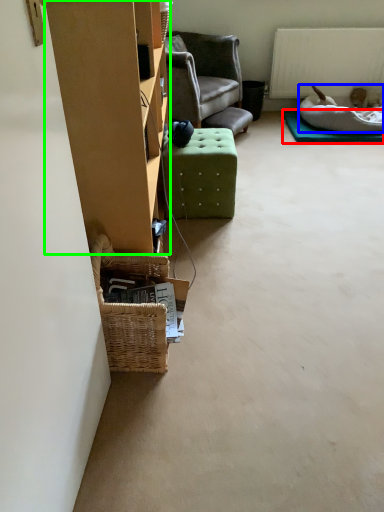
Question: Which object is positioned closest to mat (highlighted by a red box)? Select from dog bed (highlighted by a blue box) and furniture (highlighted by a green box).

Choices:
 (A) dog bed
 (B) furniture

Answer: (A)